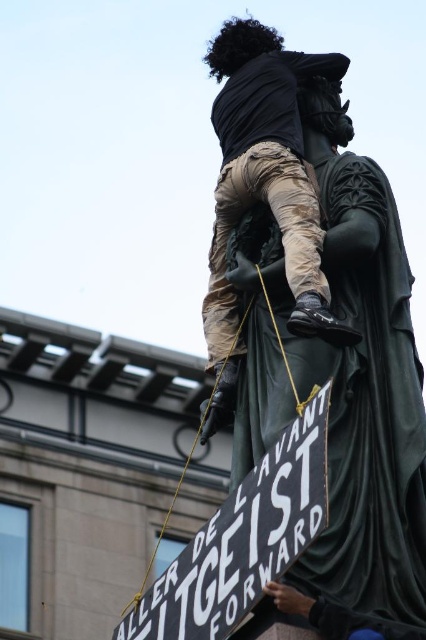
Question: Can you confirm if green marble statue at center is bigger than camouflage pants at upper center?

Choices:
 (A) no
 (B) yes

Answer: (A)

Question: Does green marble statue at center have a larger size compared to camouflage pants at upper center?

Choices:
 (A) no
 (B) yes

Answer: (A)

Question: Which of these objects is positioned closest to the black matte sign at center?

Choices:
 (A) green marble statue at center
 (B) camouflage pants at upper center

Answer: (A)

Question: Which point is closer to the camera taking this photo?

Choices:
 (A) (287, 202)
 (B) (406, 314)
 (C) (141, 593)

Answer: (B)

Question: Considering the relative positions of camouflage pants at upper center and black matte sign at center in the image provided, where is camouflage pants at upper center located with respect to black matte sign at center?

Choices:
 (A) above
 (B) below

Answer: (A)

Question: Which point is farther to the camera?

Choices:
 (A) (241, 596)
 (B) (333, 337)
 (C) (333, 547)

Answer: (B)